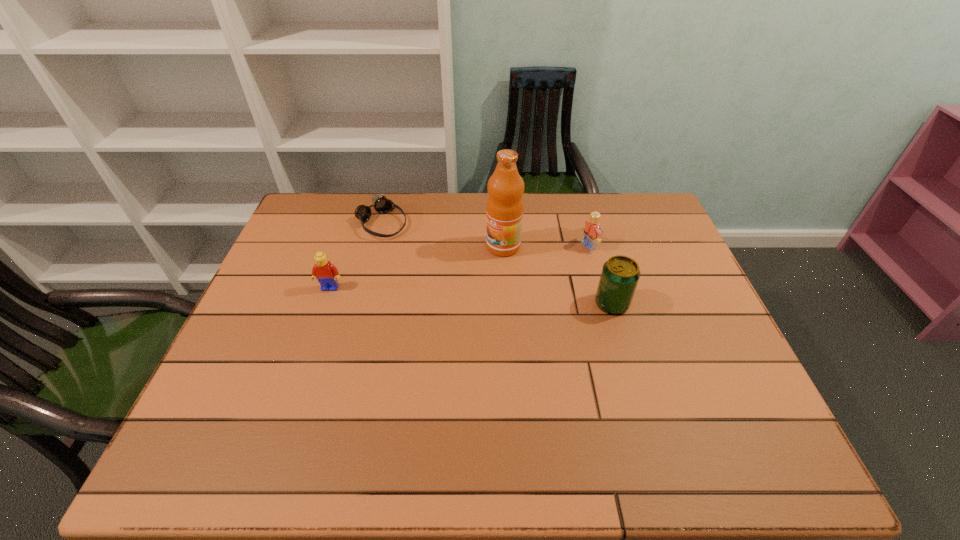
Identify the location of vacant space on the desktop that is between the nearer Lego and the beer can and is positioned on the front-facing side of the right Lego. This screenshot has height=540, width=960. (459, 295).

Where is `free space on the desktop that is between the nearer Lego and the beer can and is positioned through the lenses of the goggles`? The height and width of the screenshot is (540, 960). free space on the desktop that is between the nearer Lego and the beer can and is positioned through the lenses of the goggles is located at coordinates pyautogui.click(x=472, y=296).

I want to click on vacant space on the desktop that is between the left Lego and the beer can and is positioned on the label side of the fruit juice, so click(431, 293).